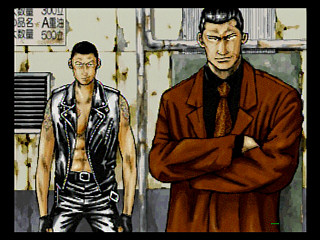
The width and height of the screenshot is (320, 240). What are the coordinates of `ac` in the screenshot? It's located at (34, 101).